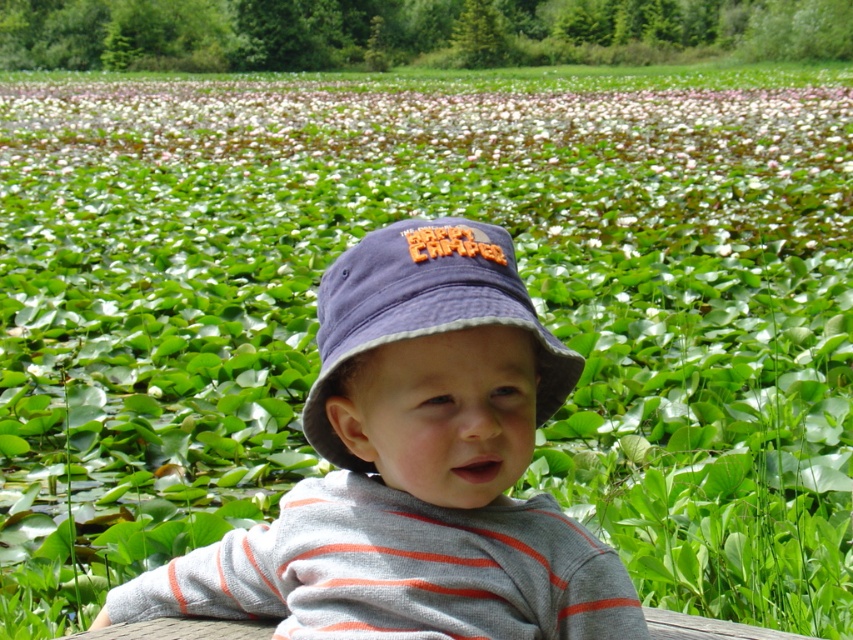
Consider the image. You are a photographer standing 30 inches away from the matte blue bucket hat at center. Can you adjust your position so that you are exactly 30.29 inches away from it to capture a perfect shot?

Yes, you can move slightly closer to the matte blue bucket hat at center so that you are exactly 30.29 inches away from it, as the current distance is 30 inches and the required distance is only 0.29 inches more.

You are a photographer trying to capture the green leafy plant at upper center and the navy blue fabric bucket hat at center in the same frame. Which object should you focus on first if you want to ensure both are in focus without adjusting the camera settings?

The green leafy plant at upper center should be focused on first because it is larger in size compared to the navy blue fabric bucket hat at center, so focusing on the larger object ensures depth of field covers both.

You are a photographer trying to capture the matte blue bucket hat at center and the green leafy plant at upper center in the same frame. Based on their positions, which object should you adjust your camera to focus on first to ensure both are in the frame?

The matte blue bucket hat at center is to the left of the green leafy plant at upper center, so you should focus on the green leafy plant at upper center first to ensure both are captured in the frame.